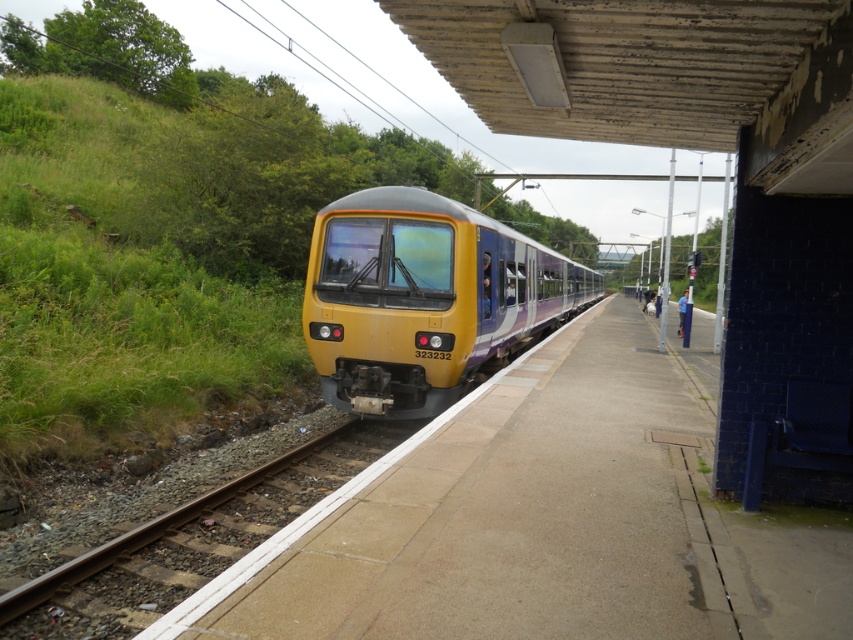
You are a passenger at the train station and want to board the yellow matte train at center. The train is on the tracks. Where should you stand relative to the brown gravel train track at lower left to board the train?

To board the yellow matte train at center, you should stand to the right of the brown gravel train track at lower left since the yellow matte train at center is positioned to the right of it.